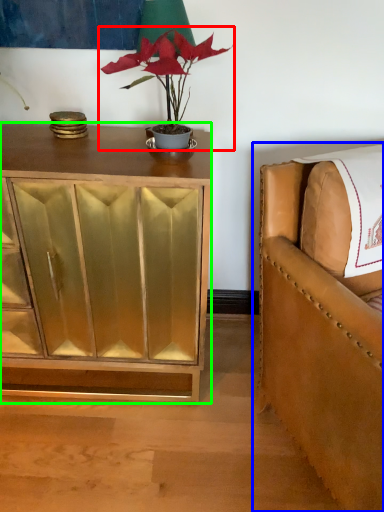
Question: Which object is positioned farthest from houseplant (highlighted by a red box)? Select from chair (highlighted by a blue box) and cabinetry (highlighted by a green box).

Choices:
 (A) chair
 (B) cabinetry

Answer: (A)